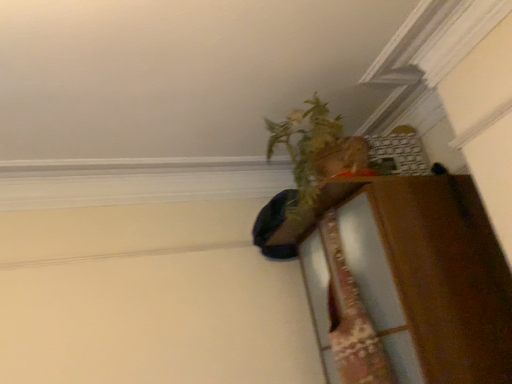
Question: Does green leafy plant at upper right have a larger size compared to wooden dresser at right?

Choices:
 (A) yes
 (B) no

Answer: (B)

Question: Would you say green leafy plant at upper right is outside wooden dresser at right?

Choices:
 (A) no
 (B) yes

Answer: (B)

Question: Considering the relative positions of green leafy plant at upper right and wooden dresser at right in the image provided, is green leafy plant at upper right in front of wooden dresser at right?

Choices:
 (A) no
 (B) yes

Answer: (A)

Question: Considering the relative positions of green leafy plant at upper right and wooden dresser at right in the image provided, is green leafy plant at upper right to the right of wooden dresser at right from the viewer's perspective?

Choices:
 (A) no
 (B) yes

Answer: (A)

Question: Is green leafy plant at upper right in contact with wooden dresser at right?

Choices:
 (A) no
 (B) yes

Answer: (A)

Question: From a real-world perspective, is green leafy plant at upper right positioned over wooden dresser at right based on gravity?

Choices:
 (A) no
 (B) yes

Answer: (B)

Question: Is wooden dresser at right to the right of green leafy plant at upper right from the viewer's perspective?

Choices:
 (A) no
 (B) yes

Answer: (B)

Question: Is wooden dresser at right smaller than green leafy plant at upper right?

Choices:
 (A) yes
 (B) no

Answer: (B)

Question: From a real-world perspective, is wooden dresser at right on top of green leafy plant at upper right?

Choices:
 (A) yes
 (B) no

Answer: (B)

Question: From the image's perspective, is wooden dresser at right below green leafy plant at upper right?

Choices:
 (A) yes
 (B) no

Answer: (A)

Question: From the image's perspective, is wooden dresser at right above green leafy plant at upper right?

Choices:
 (A) yes
 (B) no

Answer: (B)

Question: Does wooden dresser at right have a greater height compared to green leafy plant at upper right?

Choices:
 (A) yes
 (B) no

Answer: (A)

Question: Considering their positions, is green leafy plant at upper right located in front of or behind wooden dresser at right?

Choices:
 (A) behind
 (B) front

Answer: (A)